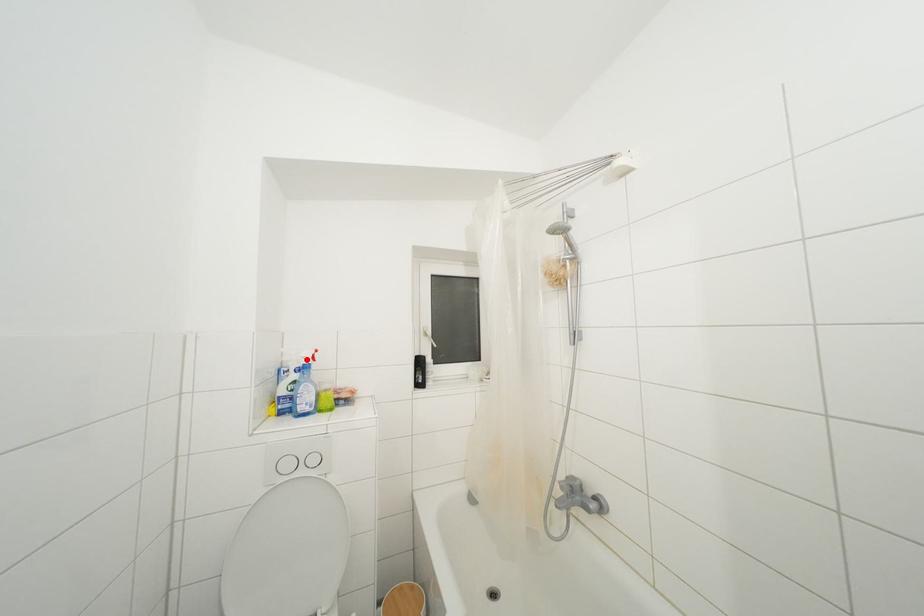
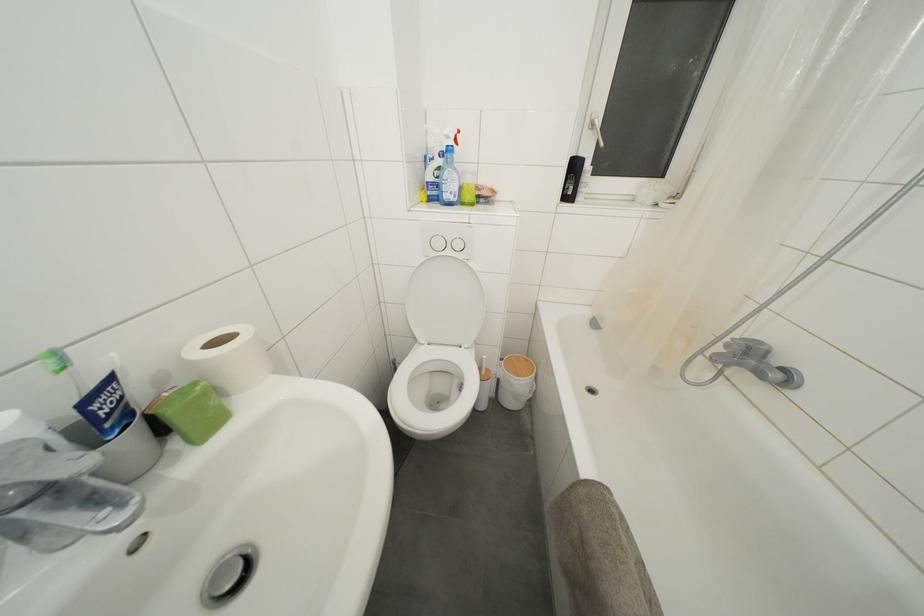
The point at the highlighted location is marked in the first image. Where is the corresponding point in the second image?

(450, 138)